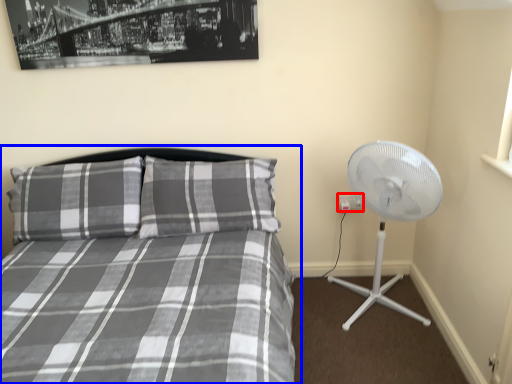
Question: Which object is further to the camera taking this photo, electric outlet (highlighted by a red box) or bed (highlighted by a blue box)?

Choices:
 (A) electric outlet
 (B) bed

Answer: (A)